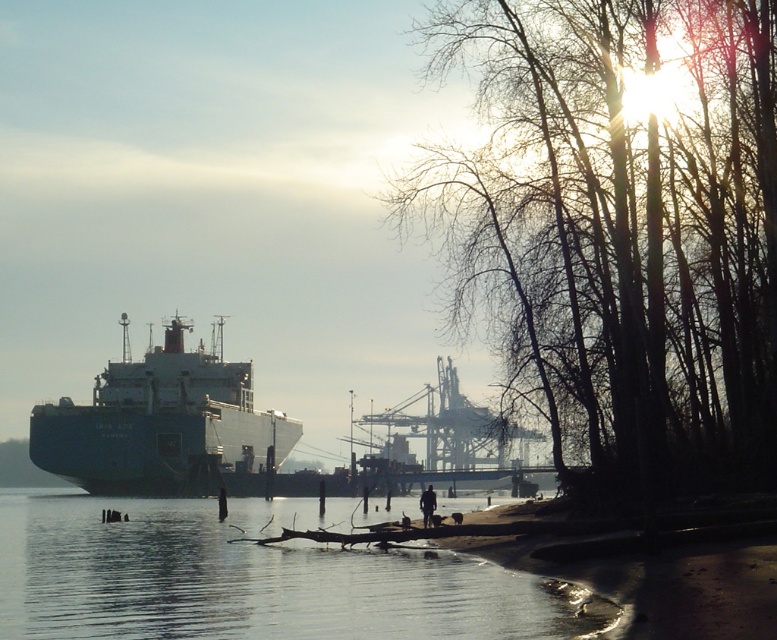
You are standing at the waterfront and see the silhouette bare trees at right and the smooth water at lower left. Which object is positioned to the east?

The smooth water at lower left is positioned to the east because the silhouette bare trees at right is to the right of it, and in the scene, the sun is casting long shadows indicating the direction of light. Since the trees are to the right of the water, and shadows are typically cast away from the sun, if the water is on the left, it suggests the sun is coming from the east, making the water at lower left the eastern side.

You are a photographer standing at the waterfront scene. You notice the silhouette bare trees at right and the dark brown leather jacket at center. Which object is positioned higher in the image?

The silhouette bare trees at right is located above the dark brown leather jacket at center, so it is positioned higher in the image.